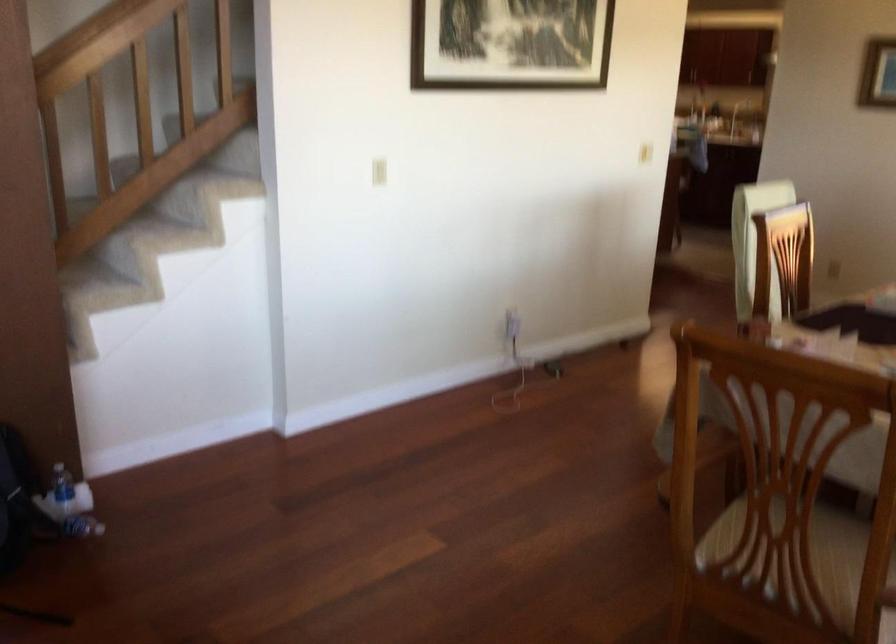
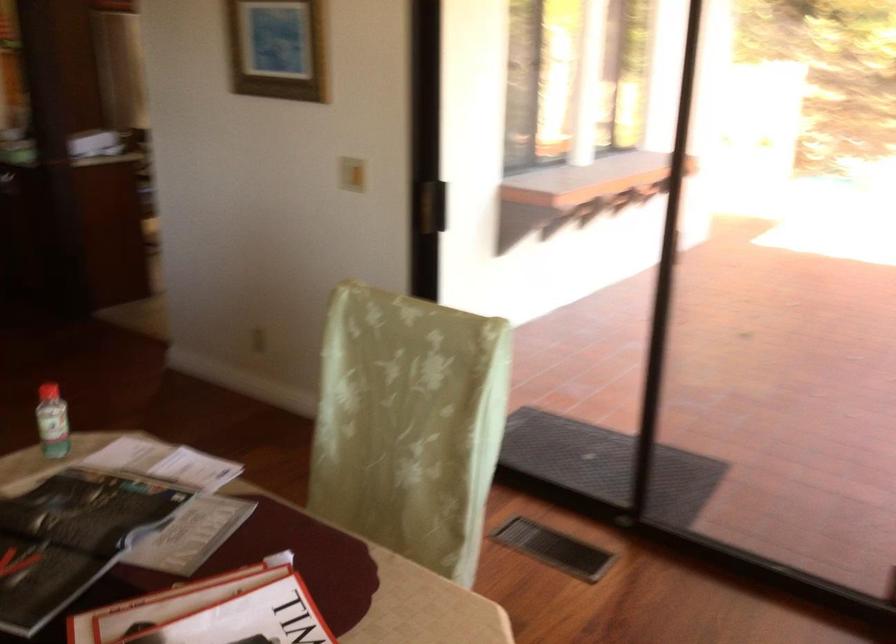
Looking at this image, which direction would the cameraman need to move to produce the second image?

The movement direction of the cameraman is right, forward.